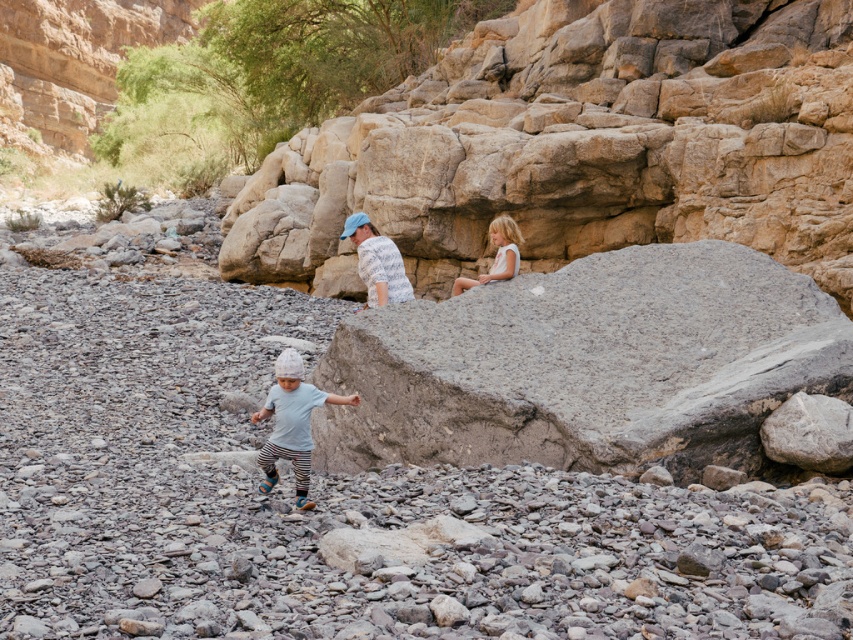
Does light blue cotton shirt at center have a larger size compared to blonde hair girl at upper right?

Yes, light blue cotton shirt at center is bigger than blonde hair girl at upper right.

Can you confirm if light blue cotton shirt at center is positioned to the left of blonde hair girl at upper right?

Answer: Yes, light blue cotton shirt at center is to the left of blonde hair girl at upper right.

Is point (293, 445) farther from camera compared to point (514, 224)?

No, it is in front of (514, 224).

In order to click on light blue cotton shirt at center in this screenshot , I will do `click(291, 422)`.

Can you confirm if gray rough rock at center is bigger than blonde hair girl at upper right?

Yes.

Who is higher up, gray rough rock at center or blonde hair girl at upper right?

gray rough rock at center is above.

Is point (811, 211) positioned after point (489, 269)?

No.

Where is `gray rough rock at center`? gray rough rock at center is located at coordinates (581, 145).

Can you confirm if gray rough boulder at center is positioned below blonde hair girl at upper right?

Indeed, gray rough boulder at center is positioned under blonde hair girl at upper right.

Can you confirm if gray rough boulder at center is positioned to the right of blonde hair girl at upper right?

Yes, gray rough boulder at center is to the right of blonde hair girl at upper right.

Where is `gray rough boulder at center`? This screenshot has width=853, height=640. gray rough boulder at center is located at coordinates (587, 365).